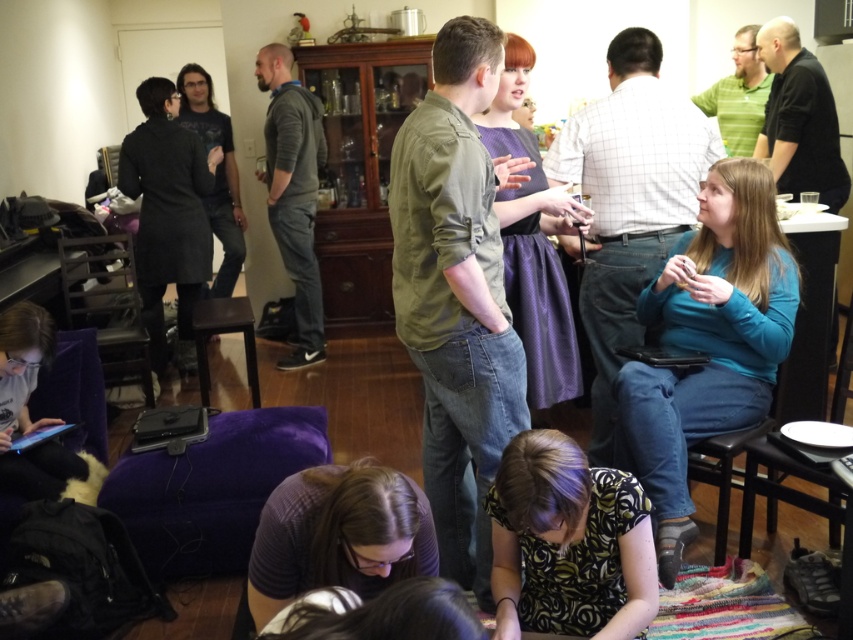
Question: Does green cotton shirt at center appear on the right side of blue fabric chair at center?

Choices:
 (A) yes
 (B) no

Answer: (B)

Question: Is printed fabric shirt at lower center further to the viewer compared to plaid shirt at lower center?

Choices:
 (A) yes
 (B) no

Answer: (A)

Question: Which object appears farthest from the camera in this image?

Choices:
 (A) black plastic stool at lower right
 (B) blue cotton shirt at right

Answer: (A)

Question: Among these objects, which one is farthest from the camera?

Choices:
 (A) matte black tablet at lower left
 (B) dark gray coat at upper left
 (C) green textured shirt at center
 (D) gray fleece hoodie at center

Answer: (D)

Question: Does plaid shirt at lower center have a greater width compared to dark gray coat at upper left?

Choices:
 (A) yes
 (B) no

Answer: (A)

Question: Which of the following is the closest to the observer?

Choices:
 (A) plaid shirt at lower center
 (B) white plastic stool at lower right
 (C) green matte shirt at upper right
 (D) green cotton shirt at center

Answer: (A)